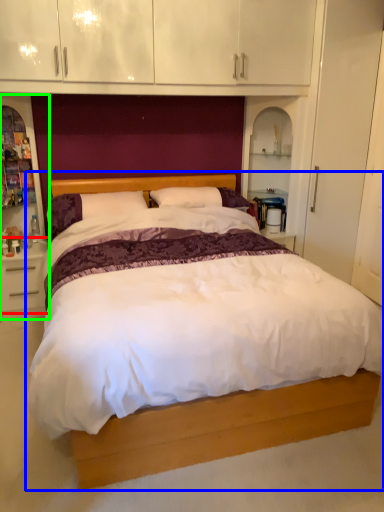
Question: Which object is the closest to the nightstand (highlighted by a red box)? Choose among these: bed (highlighted by a blue box) or dresser (highlighted by a green box).

Choices:
 (A) bed
 (B) dresser

Answer: (B)